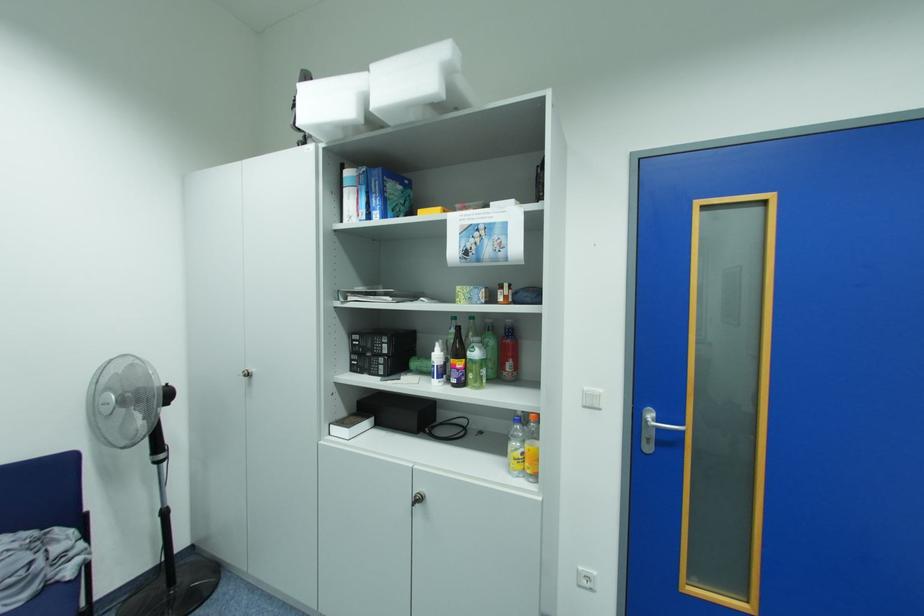
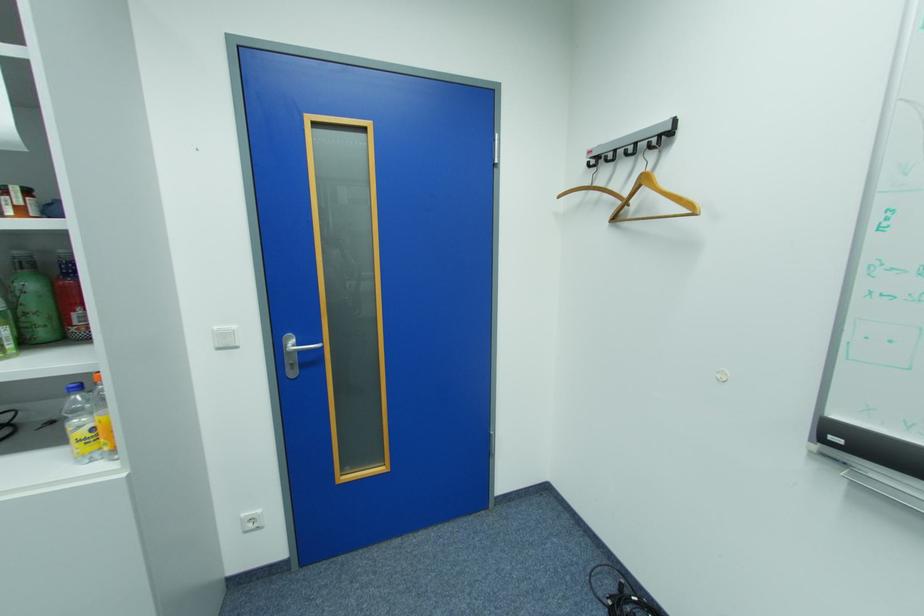
Where in the second image is the point corresponding to point 526,450 from the first image?

(89, 427)